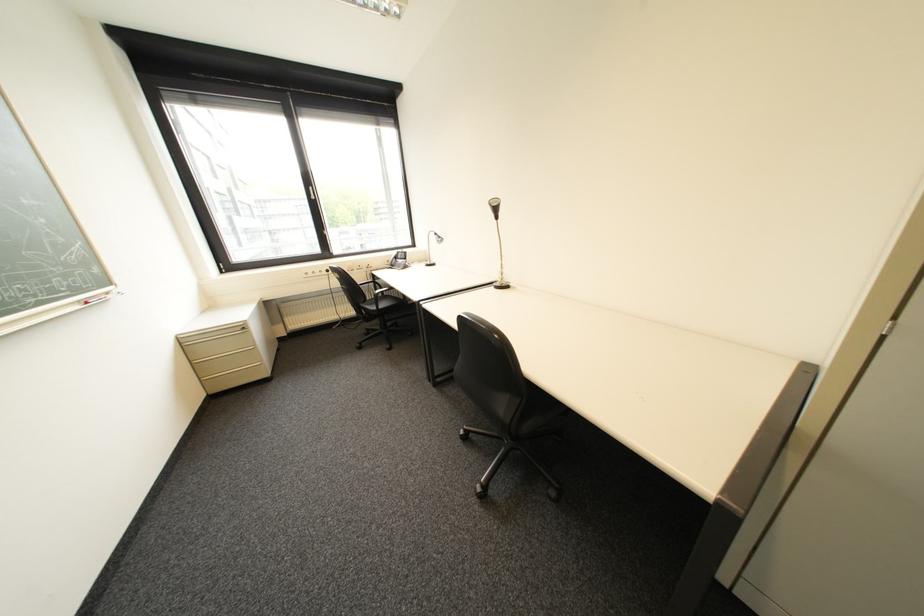
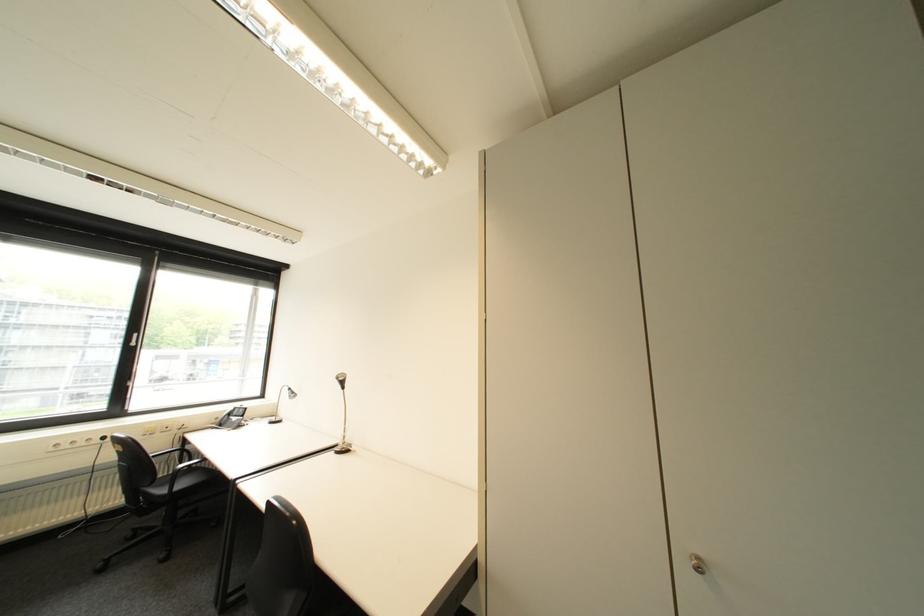
The point at (505,285) is marked in the first image. Where is the corresponding point in the second image?

(346, 450)